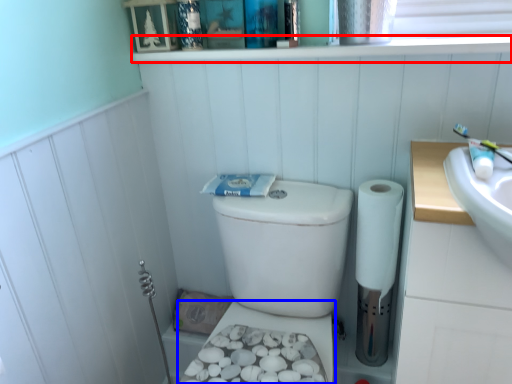
Question: Among these objects, which one is farthest to the camera, ledge (highlighted by a red box) or bidet (highlighted by a blue box)?

Choices:
 (A) ledge
 (B) bidet

Answer: (B)